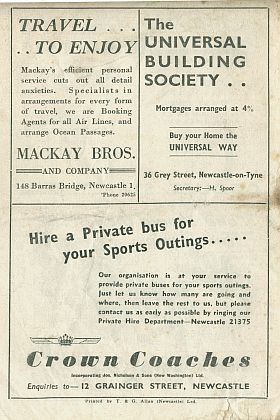
Find the location of a particular element. This screenshot has width=280, height=420. dirt / stains is located at coordinates (230, 413), (272, 419), (272, 196), (202, 2), (9, 3), (276, 5).